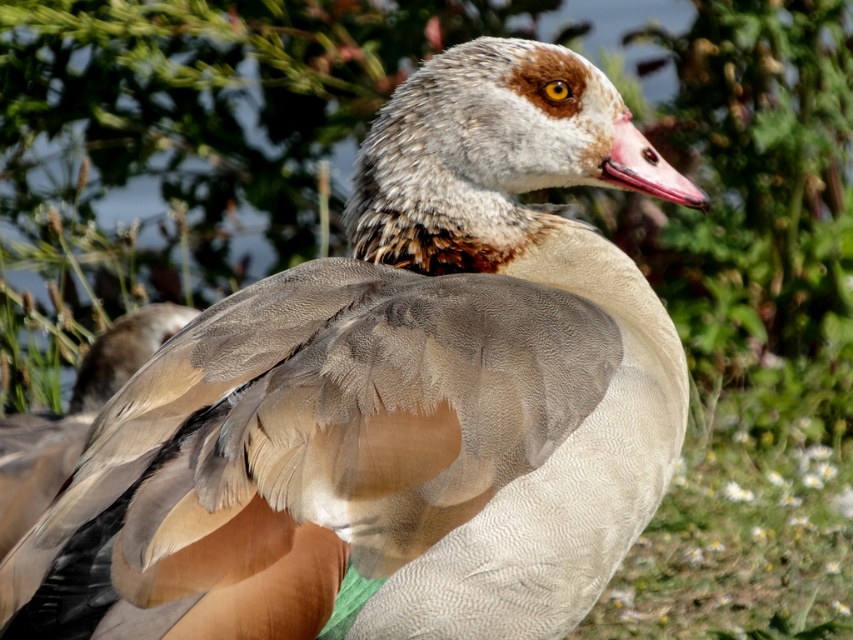
Question: Which object appears farthest from the camera in this image?

Choices:
 (A) brown feathered wing at center
 (B) pink matte beak at center

Answer: (A)

Question: Observing the image, what is the correct spatial positioning of brown feathered wing at center in reference to pink matte beak at center?

Choices:
 (A) right
 (B) left

Answer: (B)

Question: Which object is farther from the camera taking this photo?

Choices:
 (A) brown feathered wing at center
 (B) pink matte beak at center

Answer: (A)

Question: Which point appears farthest from the camera in this image?

Choices:
 (A) (79, 385)
 (B) (606, 170)

Answer: (A)

Question: In this image, where is brown feathered wing at center located relative to pink matte beak at center?

Choices:
 (A) above
 (B) below

Answer: (B)

Question: Does brown feathered wing at center lie in front of pink matte beak at center?

Choices:
 (A) yes
 (B) no

Answer: (B)